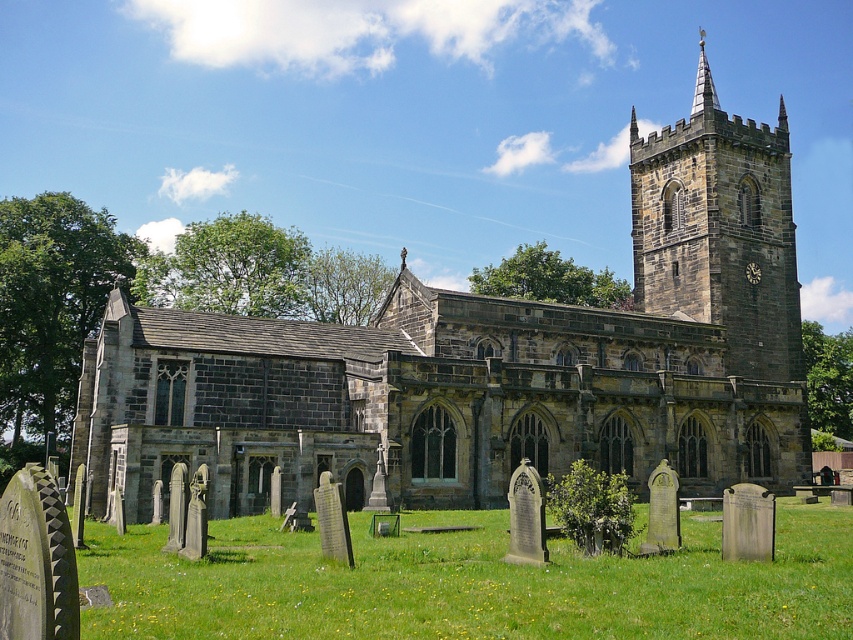
Is dark gray stone church at center positioned behind dark gray stone tower at upper right?

No, dark gray stone church at center is in front of dark gray stone tower at upper right.

Is point (341, 433) closer to camera compared to point (793, 362)?

That is True.

Does point (531, 444) come in front of point (718, 262)?

Yes, point (531, 444) is in front of point (718, 262).

This screenshot has width=853, height=640. I want to click on dark gray stone church at center, so click(489, 362).

Can you confirm if dark gray stone church at center is shorter than green grass at lower center?

No, dark gray stone church at center is not shorter than green grass at lower center.

What do you see at coordinates (489, 362) in the screenshot?
I see `dark gray stone church at center` at bounding box center [489, 362].

The height and width of the screenshot is (640, 853). What are the coordinates of `dark gray stone church at center` in the screenshot? It's located at (489, 362).

This screenshot has height=640, width=853. In order to click on dark gray stone church at center in this screenshot , I will do `click(489, 362)`.

Which is more to the right, green grass at lower center or dark gray stone tower at upper right?

Answer: dark gray stone tower at upper right

Who is taller, green grass at lower center or dark gray stone tower at upper right?

dark gray stone tower at upper right

Find the location of `green grass at lower center`. green grass at lower center is located at coordinates (468, 582).

Where is `green grass at lower center`? green grass at lower center is located at coordinates (468, 582).